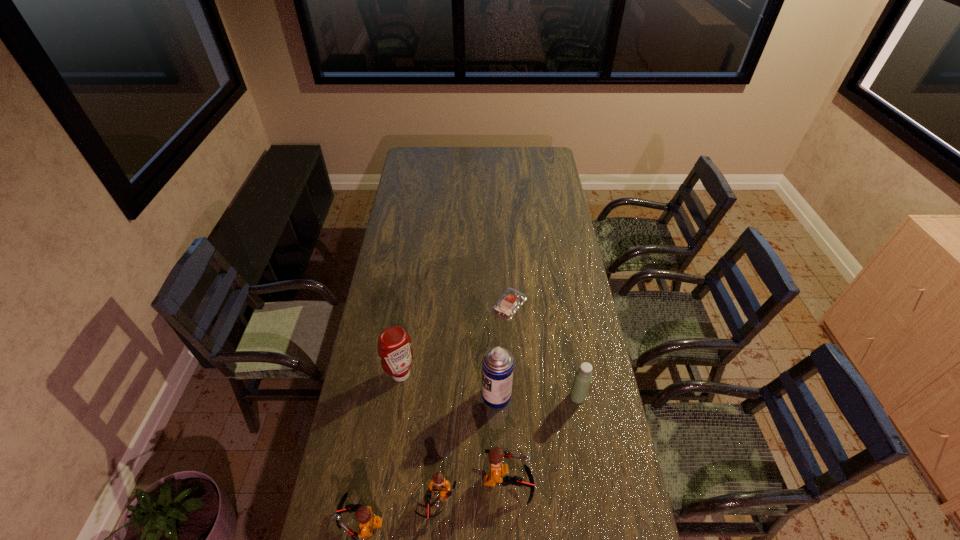
With all Legos evenly spaced, where should an extra Lego be placed on the right to continue the pattern? Please point out a vacant space. Please provide its 2D coordinates. Your answer should be formatted as a tuple, i.e. [(x, y)], where the tuple contains the x and y coordinates of a point satisfying the conditions above.

[(576, 463)]